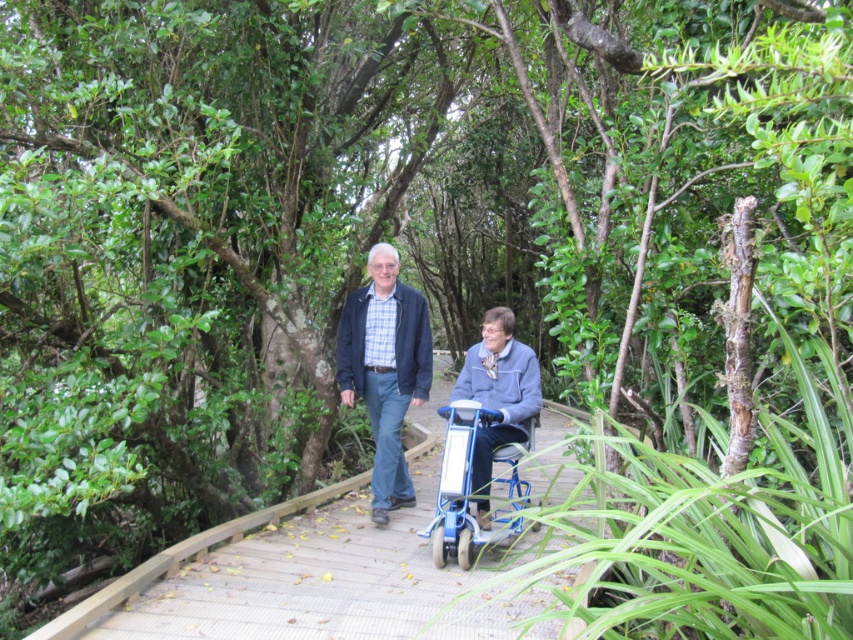
Is point (184, 573) behind point (482, 410)?

That is False.

Does wooden walkway at center appear over blue metallic wheelchair at center?

Actually, wooden walkway at center is below blue metallic wheelchair at center.

Who is more distant from viewer, (180, 634) or (476, 522)?

Point (476, 522)

I want to click on wooden walkway at center, so click(289, 572).

Who is more distant from viewer, (473, 625) or (392, 324)?

Positioned behind is point (392, 324).

Does wooden walkway at center have a smaller size compared to blue plaid shirt at center?

Indeed, wooden walkway at center has a smaller size compared to blue plaid shirt at center.

This screenshot has width=853, height=640. Find the location of `wooden walkway at center`. wooden walkway at center is located at coordinates [x=289, y=572].

Is point (508, 536) more distant than point (498, 326)?

No, (508, 536) is in front of (498, 326).

Describe the element at coordinates (462, 486) in the screenshot. I see `blue metallic wheelchair at center` at that location.

Is point (451, 438) farther from camera compared to point (489, 522)?

No.

The width and height of the screenshot is (853, 640). What are the coordinates of `blue metallic wheelchair at center` in the screenshot? It's located at (462, 486).